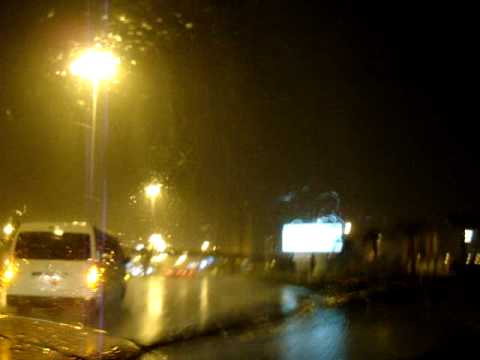
Identify the location of lamp. Image resolution: width=480 pixels, height=360 pixels. (94, 70).